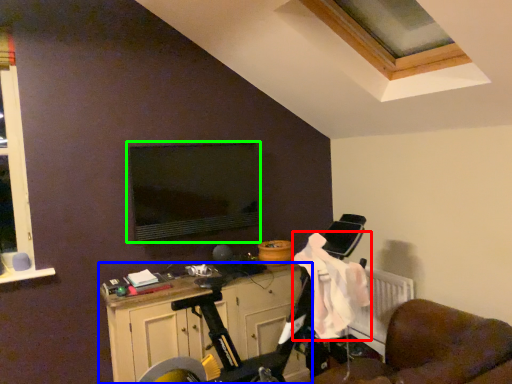
Question: Based on their relative distances, which object is nearer to laundry (highlighted by a red box)? Choose from cabinetry (highlighted by a blue box) and computer monitor (highlighted by a green box).

Choices:
 (A) cabinetry
 (B) computer monitor

Answer: (A)